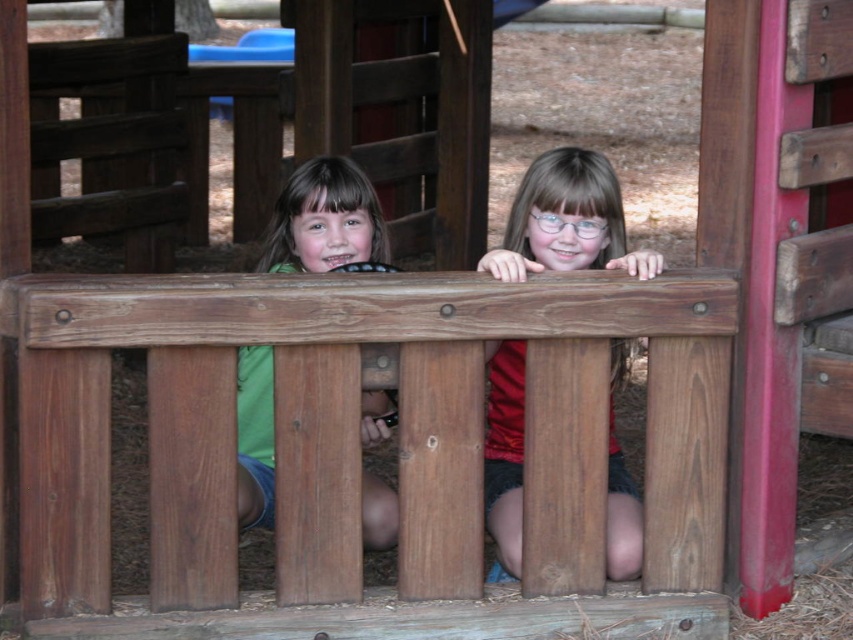
You are a photographer trying to capture both the green matte shirt at center and the blue plastic slide at upper center in a single frame. Based on their sizes, which object should you focus on first to ensure both are in the frame?

The green matte shirt at center has a lesser width compared to the blue plastic slide at upper center, so you should focus on the blue plastic slide at upper center first to ensure both fit in the frame.

You are a photographer trying to capture the two children in the scene. You notice two specific points marked in the image. The first point is at coordinate point (339, 160) and the second is at point (292, 40). Which point is closer to the camera?

Point (339, 160) is in front of point (292, 40), so the first point is closer to the camera.

You are a photographer trying to capture both children in a single shot. The camera you are using has a lens that can focus on objects within a 24 inch range. Are both the matte red shirt at center and the green matte shirt at center within the camera lens range?

The matte red shirt at center is 24.20 inches from the green matte shirt at center, which is slightly beyond the camera lens range of 24 inches. Therefore, both shirts may not be in focus simultaneously.